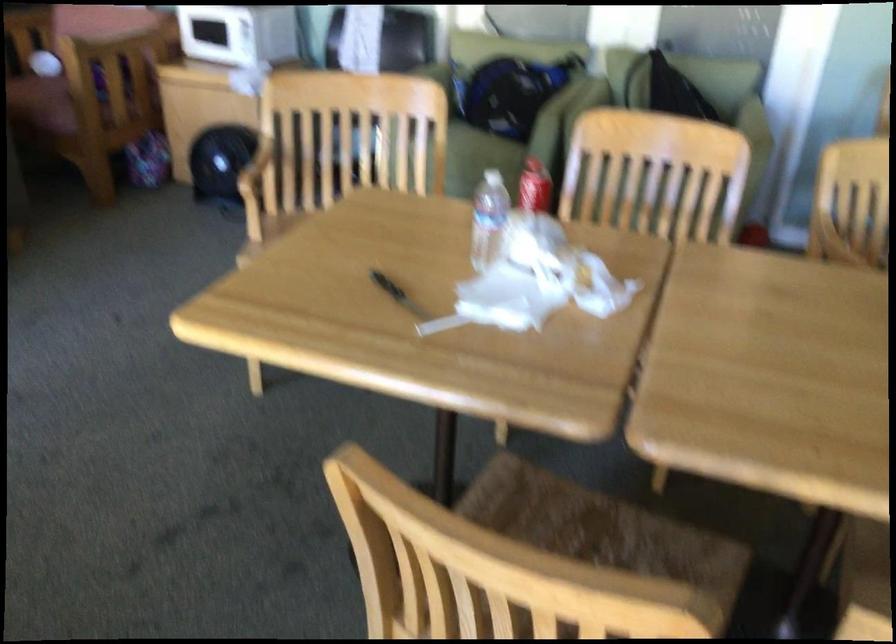
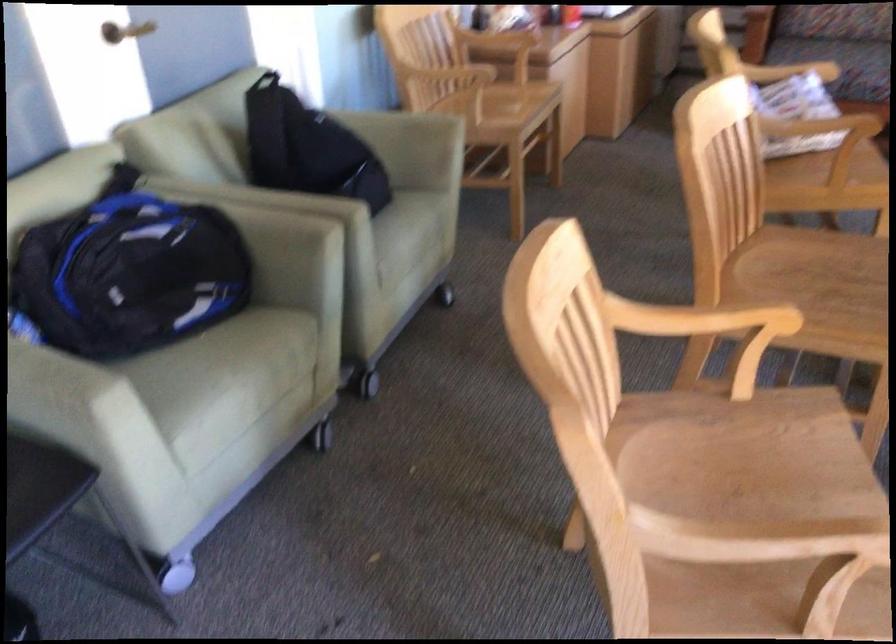
Where in the second image is the point corresponding to (739,128) from the first image?

(405, 124)